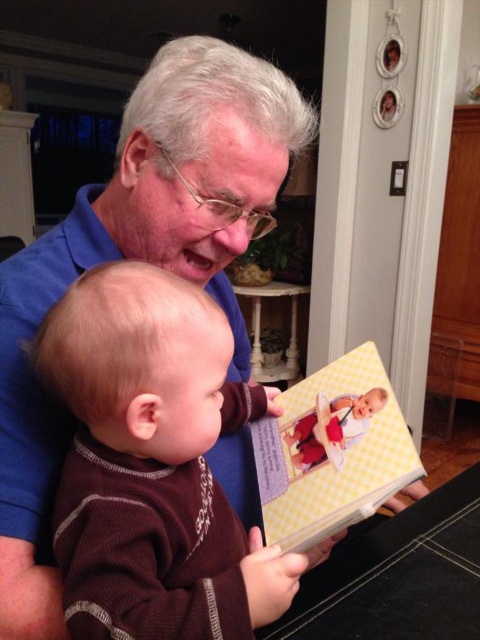
Question: Can you confirm if blue smooth shirt at upper left is positioned to the right of yellow checkered book at center?

Choices:
 (A) no
 (B) yes

Answer: (A)

Question: Is blue smooth shirt at upper left above yellow checkered book at center?

Choices:
 (A) yes
 (B) no

Answer: (A)

Question: Which of the following is the farthest from the observer?

Choices:
 (A) (288, 451)
 (B) (58, 234)

Answer: (A)

Question: Which point appears farthest from the camera in this image?

Choices:
 (A) click(351, 486)
 (B) click(3, 317)

Answer: (A)

Question: Is blue smooth shirt at upper left wider than yellow checkered book at center?

Choices:
 (A) yes
 (B) no

Answer: (A)